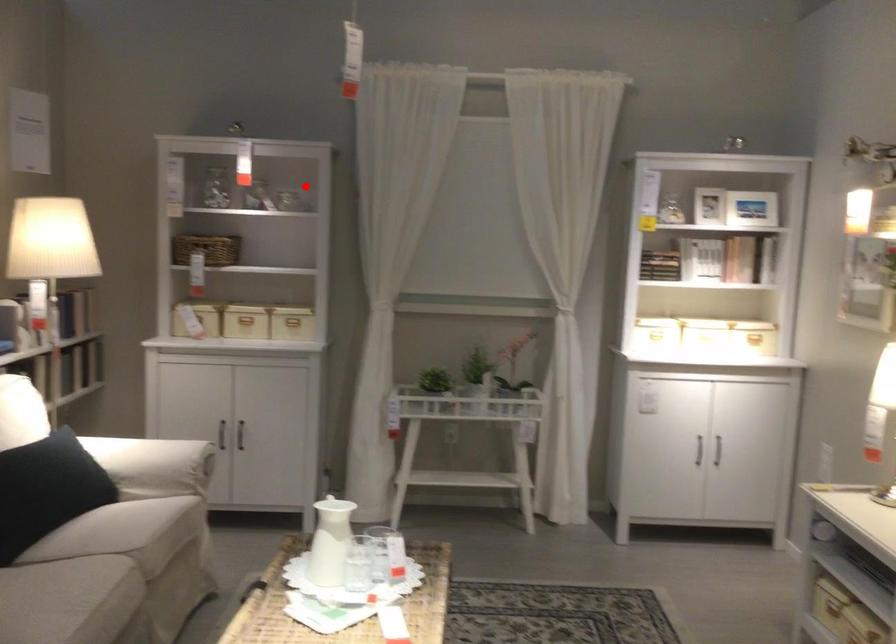
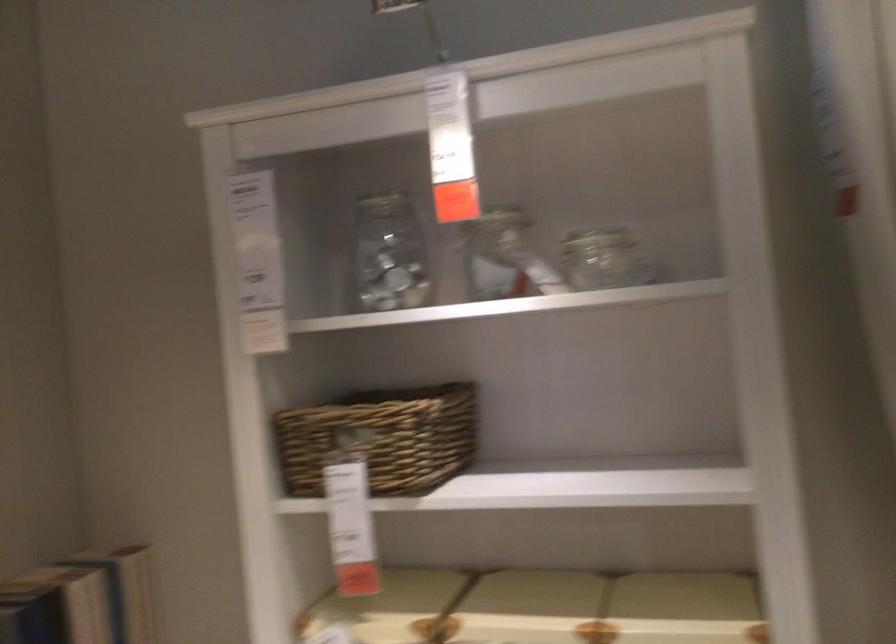
Question: I am providing you with two images of the same scene from different viewpoints. Given a red point in image1, look at the same physical point in image2. Is it:

Choices:
 (A) Closer to the viewpoint
 (B) Farther from the viewpoint

Answer: (A)